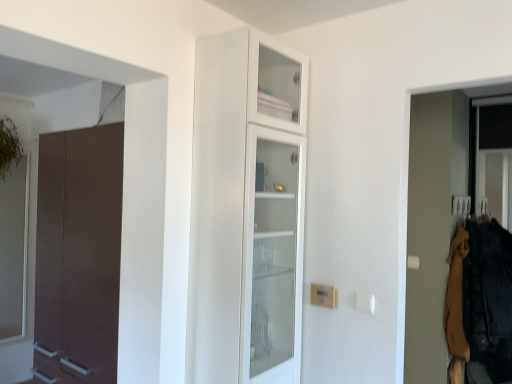
Measure the distance between point (462,353) and camera.

Point (462,353) is 2.70 meters from camera.

Measure the distance between brown woolen sweater at right, the first clothing when ordered from left to right, and camera.

brown woolen sweater at right, the first clothing when ordered from left to right, is 8.76 feet away from camera.

Measure the distance between point (496,314) and camera.

8.93 feet.

Identify the location of white glass cabinet at center. (247, 211).

You are a GUI agent. You are given a task and a screenshot of the screen. Output one action in this format:
    pyautogui.click(x=<x>, y=<y>)
    Task: Click on the brown woolen sweater at right, the second clothing viewed from the right
    This screenshot has width=512, height=384.
    Given the screenshot: What is the action you would take?
    pyautogui.click(x=456, y=307)

From a real-world perspective, does brown woolen sweater at right, the first clothing when ordered from left to right, sit lower than dark brown fabric at right, arranged as the 2th clothing when viewed from the left?

No.

Consider the image. Is brown woolen sweater at right, the second clothing viewed from the right, oriented away from dark brown fabric at right, marked as the 1th clothing in a right-to-left arrangement?

That's right, brown woolen sweater at right, the second clothing viewed from the right, is facing away from dark brown fabric at right, marked as the 1th clothing in a right-to-left arrangement.

Would you say brown woolen sweater at right, the second clothing viewed from the right, is outside dark brown fabric at right, marked as the 1th clothing in a right-to-left arrangement?

brown woolen sweater at right, the second clothing viewed from the right, lies outside dark brown fabric at right, marked as the 1th clothing in a right-to-left arrangement,'s area.

Measure the distance from brown woolen sweater at right, the first clothing when ordered from left to right, to dark brown fabric at right, marked as the 1th clothing in a right-to-left arrangement.

The distance of brown woolen sweater at right, the first clothing when ordered from left to right, from dark brown fabric at right, marked as the 1th clothing in a right-to-left arrangement, is 3.50 inches.

Considering the positions of points (267, 39) and (448, 295), is point (267, 39) closer to camera compared to point (448, 295)?

That is True.

From the image's perspective, who appears lower, white glass cabinet at center or brown woolen sweater at right, the first clothing when ordered from left to right?

brown woolen sweater at right, the first clothing when ordered from left to right.

Can we say white glass cabinet at center lies outside brown woolen sweater at right, the first clothing when ordered from left to right?

Absolutely, white glass cabinet at center is external to brown woolen sweater at right, the first clothing when ordered from left to right.

How distant is white glass cabinet at center from brown woolen sweater at right, the second clothing viewed from the right?

They are 1.71 meters apart.

From a real-world perspective, is dark brown fabric at right, arranged as the 2th clothing when viewed from the left, on top of brown woolen sweater at right, the second clothing viewed from the right?

No, from a real-world perspective, dark brown fabric at right, arranged as the 2th clothing when viewed from the left, is not above brown woolen sweater at right, the second clothing viewed from the right.

Considering the relative sizes of dark brown fabric at right, marked as the 1th clothing in a right-to-left arrangement, and brown woolen sweater at right, the first clothing when ordered from left to right, in the image provided, is dark brown fabric at right, marked as the 1th clothing in a right-to-left arrangement, bigger than brown woolen sweater at right, the first clothing when ordered from left to right,?

Yes, dark brown fabric at right, marked as the 1th clothing in a right-to-left arrangement, is bigger than brown woolen sweater at right, the first clothing when ordered from left to right.

Which is more distant, [485,336] or [447,287]?

The point [447,287] is behind.

In the scene shown: From the image's perspective, between brown woolen sweater at right, the first clothing when ordered from left to right, and white glass cabinet at center, who is located below?

From the image's view, brown woolen sweater at right, the first clothing when ordered from left to right, is below.

Is brown woolen sweater at right, the second clothing viewed from the right, not inside white glass cabinet at center?

brown woolen sweater at right, the second clothing viewed from the right, is positioned outside white glass cabinet at center.

Is brown woolen sweater at right, the first clothing when ordered from left to right, not close to white glass cabinet at center?

Yes, brown woolen sweater at right, the first clothing when ordered from left to right, and white glass cabinet at center are located far from each other.

Does point (461, 362) appear closer or farther from the camera than point (269, 89)?

Clearly, point (461, 362) is more distant from the camera than point (269, 89).

Can you confirm if white glass cabinet at center is bigger than dark brown fabric at right, arranged as the 2th clothing when viewed from the left?

Incorrect, white glass cabinet at center is not larger than dark brown fabric at right, arranged as the 2th clothing when viewed from the left.

Does white glass cabinet at center turn towards dark brown fabric at right, arranged as the 2th clothing when viewed from the left?

No, white glass cabinet at center is not aimed at dark brown fabric at right, arranged as the 2th clothing when viewed from the left.

Would you say white glass cabinet at center is a long distance from dark brown fabric at right, arranged as the 2th clothing when viewed from the left?

white glass cabinet at center is far away from dark brown fabric at right, arranged as the 2th clothing when viewed from the left.

Considering the positions of objects white glass cabinet at center and dark brown fabric at right, arranged as the 2th clothing when viewed from the left, in the image provided, who is in front, white glass cabinet at center or dark brown fabric at right, arranged as the 2th clothing when viewed from the left,?

Positioned in front is white glass cabinet at center.

Considering the sizes of dark brown fabric at right, marked as the 1th clothing in a right-to-left arrangement, and white glass cabinet at center in the image, is dark brown fabric at right, marked as the 1th clothing in a right-to-left arrangement, taller or shorter than white glass cabinet at center?

Considering their sizes, dark brown fabric at right, marked as the 1th clothing in a right-to-left arrangement, has less height than white glass cabinet at center.

How much distance is there between dark brown fabric at right, marked as the 1th clothing in a right-to-left arrangement, and white glass cabinet at center?

They are 1.68 meters apart.

Is dark brown fabric at right, arranged as the 2th clothing when viewed from the left, next to white glass cabinet at center and touching it?

dark brown fabric at right, arranged as the 2th clothing when viewed from the left, and white glass cabinet at center are clearly separated.

Which object is further away from the camera taking this photo, dark brown fabric at right, arranged as the 2th clothing when viewed from the left, or white glass cabinet at center?

dark brown fabric at right, arranged as the 2th clothing when viewed from the left, is more distant.

What are the coordinates of `clothing behind the dark brown fabric at right, marked as the 1th clothing in a right-to-left arrangement` in the screenshot? It's located at (456, 307).

The image size is (512, 384). I want to click on the 1st clothing counting from the right of the white glass cabinet at center, so click(x=456, y=307).

Considering their positions, is white glass cabinet at center positioned further to brown woolen sweater at right, the second clothing viewed from the right, than dark brown fabric at right, marked as the 1th clothing in a right-to-left arrangement?

white glass cabinet at center is positioned further to the anchor brown woolen sweater at right, the second clothing viewed from the right.

Estimate the real-world distances between objects in this image. Which object is further from brown woolen sweater at right, the first clothing when ordered from left to right, dark brown fabric at right, arranged as the 2th clothing when viewed from the left, or white glass cabinet at center?

white glass cabinet at center is further to brown woolen sweater at right, the first clothing when ordered from left to right.

Estimate the real-world distances between objects in this image. Which object is further from white glass cabinet at center, brown woolen sweater at right, the second clothing viewed from the right, or dark brown fabric at right, marked as the 1th clothing in a right-to-left arrangement?

Among the two, brown woolen sweater at right, the second clothing viewed from the right, is located further to white glass cabinet at center.

Considering their positions, is dark brown fabric at right, arranged as the 2th clothing when viewed from the left, positioned closer to white glass cabinet at center than brown woolen sweater at right, the first clothing when ordered from left to right?

dark brown fabric at right, arranged as the 2th clothing when viewed from the left.

In the scene shown: From the image, which object appears to be nearer to dark brown fabric at right, marked as the 1th clothing in a right-to-left arrangement, brown woolen sweater at right, the second clothing viewed from the right, or white glass cabinet at center?

The object closer to dark brown fabric at right, marked as the 1th clothing in a right-to-left arrangement, is brown woolen sweater at right, the second clothing viewed from the right.

From the image, which object appears to be nearer to dark brown fabric at right, marked as the 1th clothing in a right-to-left arrangement, white glass cabinet at center or brown woolen sweater at right, the first clothing when ordered from left to right?

Based on the image, brown woolen sweater at right, the first clothing when ordered from left to right, appears to be nearer to dark brown fabric at right, marked as the 1th clothing in a right-to-left arrangement.

The height and width of the screenshot is (384, 512). I want to click on clothing between white glass cabinet at center and dark brown fabric at right, marked as the 1th clothing in a right-to-left arrangement, so click(x=456, y=307).